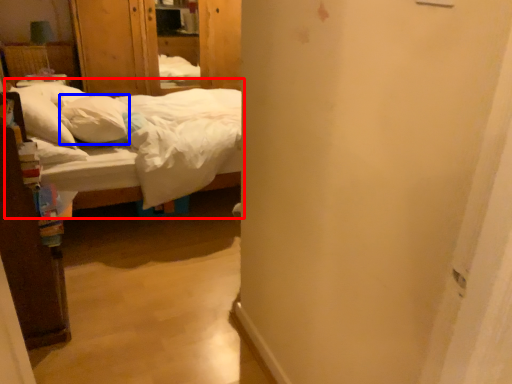
Question: Which object is closer to the camera taking this photo, bed (highlighted by a red box) or pillow (highlighted by a blue box)?

Choices:
 (A) bed
 (B) pillow

Answer: (A)